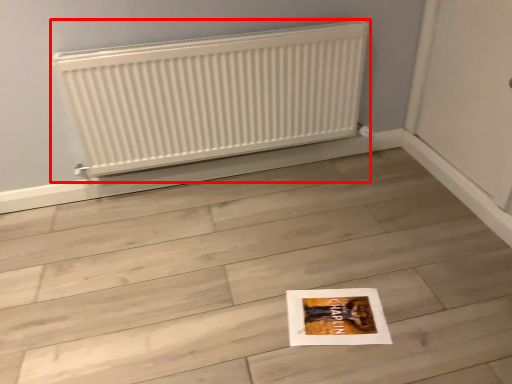
Question: In this image, where is radiator (annotated by the red box) located relative to tile?

Choices:
 (A) right
 (B) left

Answer: (B)